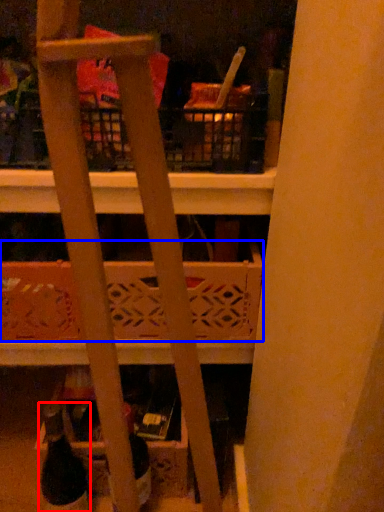
Question: Which object is further to the camera taking this photo, wine bottle (highlighted by a red box) or basket (highlighted by a blue box)?

Choices:
 (A) wine bottle
 (B) basket

Answer: (B)